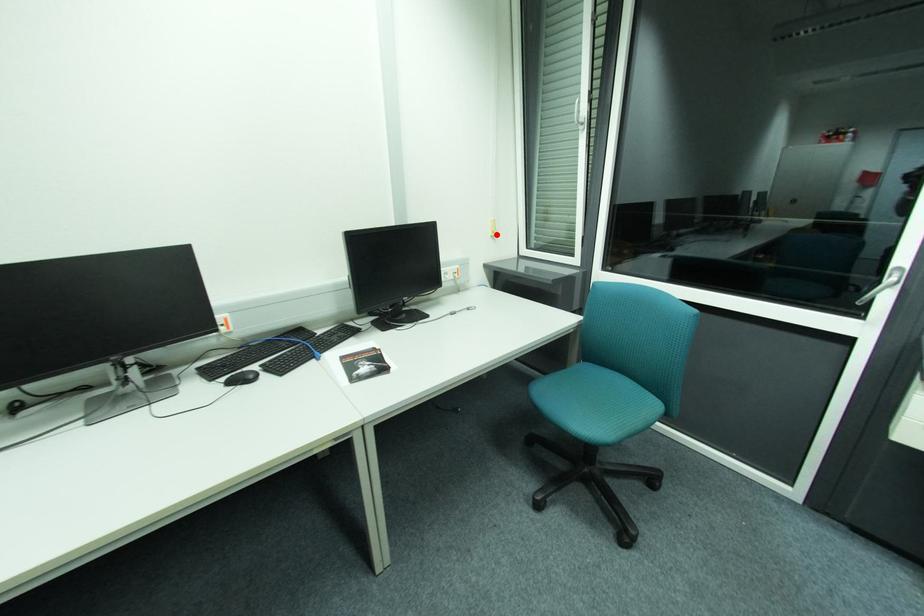
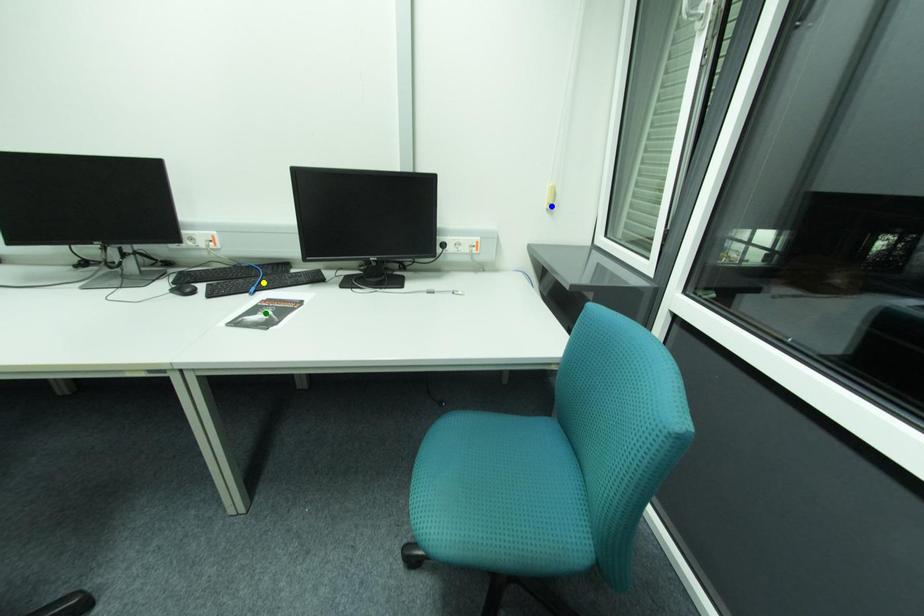
Question: I am providing you with two images of the same scene from different viewpoints. A red point is marked on the first image. You are given multiple points on the second image. Which point in image 2 is actually the same real-world point as the red point in image 1?

Choices:
 (A) yellow point
 (B) blue point
 (C) green point

Answer: (B)